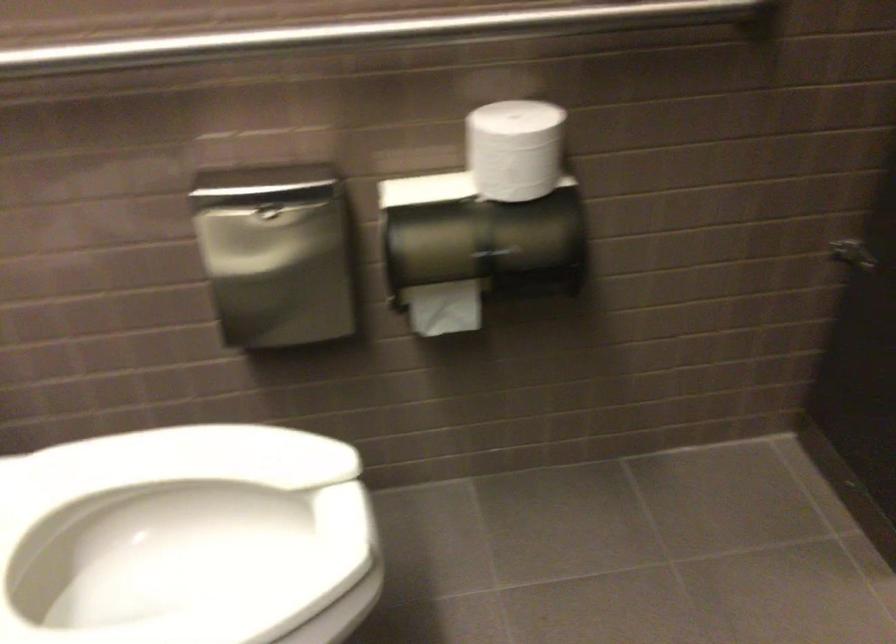
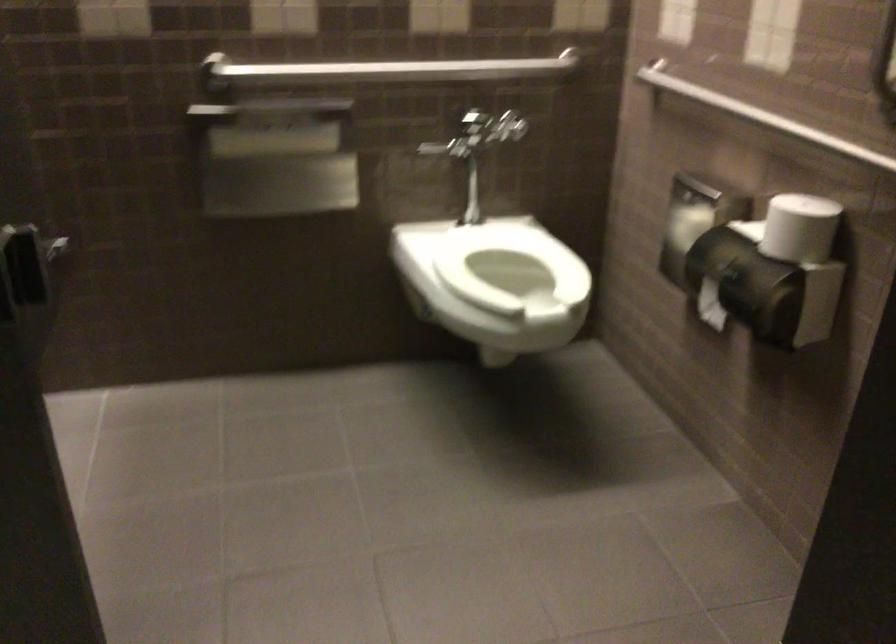
Where in the second image is the point corresponding to [561,145] from the first image?

(799, 228)